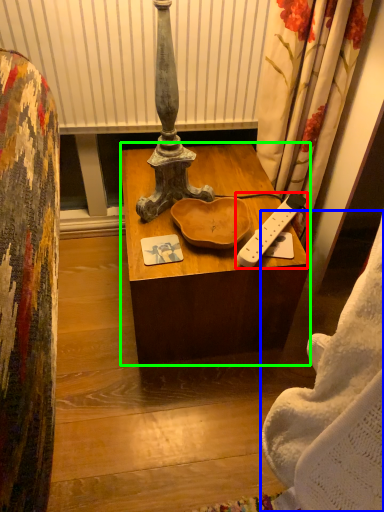
Question: Which object is positioned farthest from remote control (highlighted by a red box)? Select from blanket (highlighted by a blue box) and desk (highlighted by a green box).

Choices:
 (A) blanket
 (B) desk

Answer: (A)